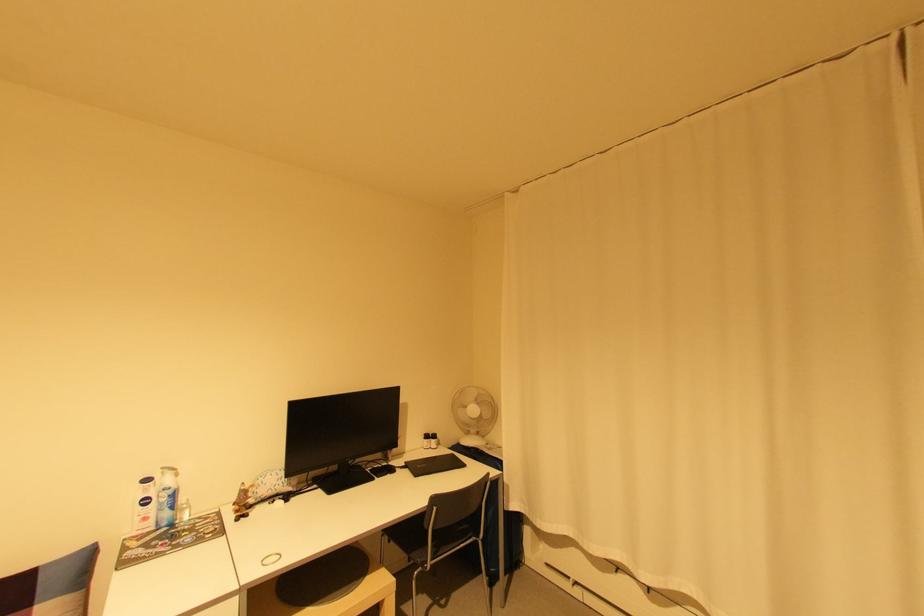
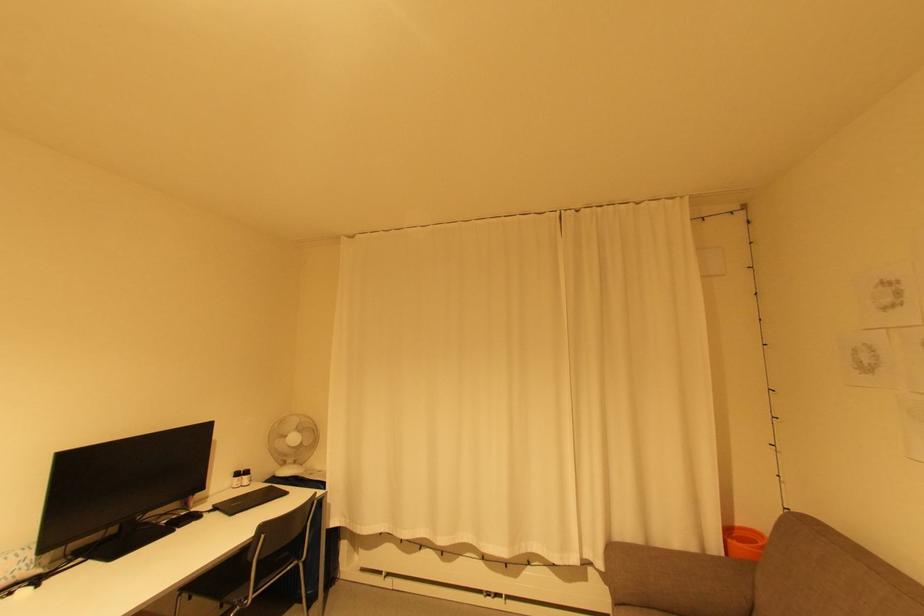
Find the pixel in the second image that matches point (478, 411) in the first image.

(298, 439)